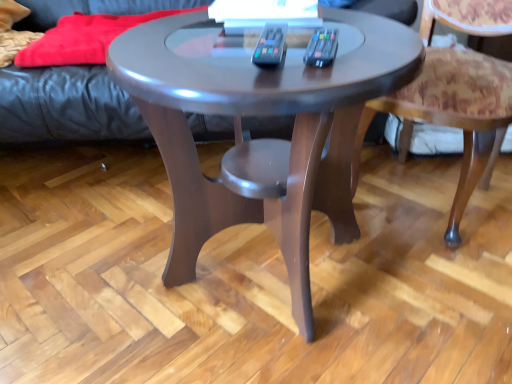
Where is `free space to the left of glossy wood coffee table at center`? This screenshot has height=384, width=512. free space to the left of glossy wood coffee table at center is located at coordinates (85, 254).